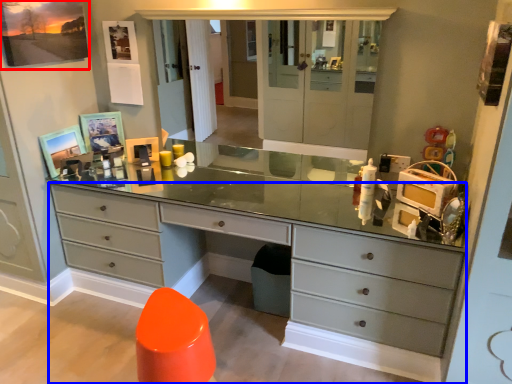
Question: Among these objects, which one is nearest to the camera, picture frame (highlighted by a red box) or chest of drawers (highlighted by a blue box)?

Choices:
 (A) picture frame
 (B) chest of drawers

Answer: (B)